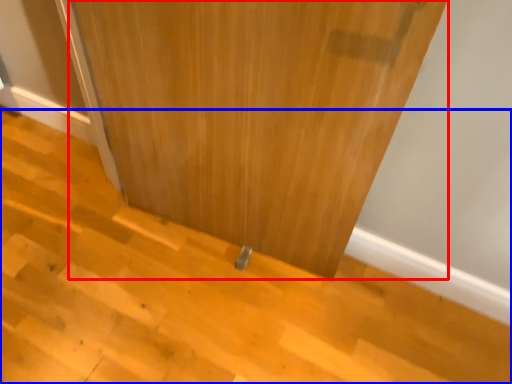
Question: Among these objects, which one is nearest to the camera, door (highlighted by a red box) or stair (highlighted by a blue box)?

Choices:
 (A) door
 (B) stair

Answer: (A)